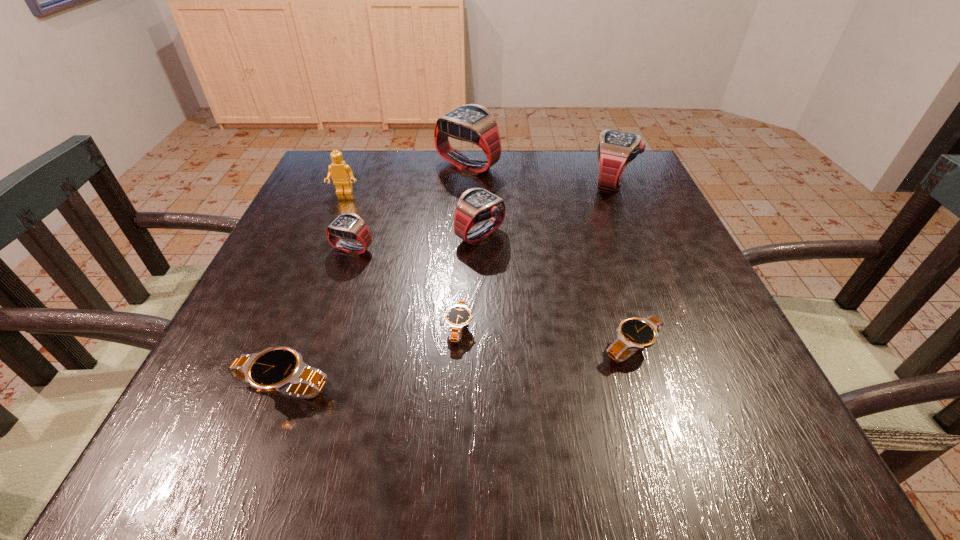
Where is `vacant space that satisfies the following two spatial constraints: 1. on the back side of the leftmost black watch; 2. on the left side of the tallest object`? vacant space that satisfies the following two spatial constraints: 1. on the back side of the leftmost black watch; 2. on the left side of the tallest object is located at coordinates pos(367,166).

Where is `free space that satisfies the following two spatial constraints: 1. on the back side of the leftmost black watch; 2. on the left side of the third biggest red watch`? The image size is (960, 540). free space that satisfies the following two spatial constraints: 1. on the back side of the leftmost black watch; 2. on the left side of the third biggest red watch is located at coordinates [341, 235].

Find the location of a particular element. Image resolution: width=960 pixels, height=540 pixels. free point that satisfies the following two spatial constraints: 1. on the back side of the second biggest red watch; 2. on the left side of the second black watch from left to right is located at coordinates (467, 181).